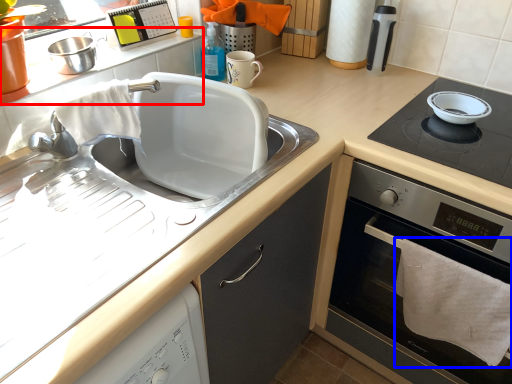
Question: Which point is further to the camera, counter top (highlighted by a red box) or bath towel (highlighted by a blue box)?

Choices:
 (A) counter top
 (B) bath towel

Answer: (A)